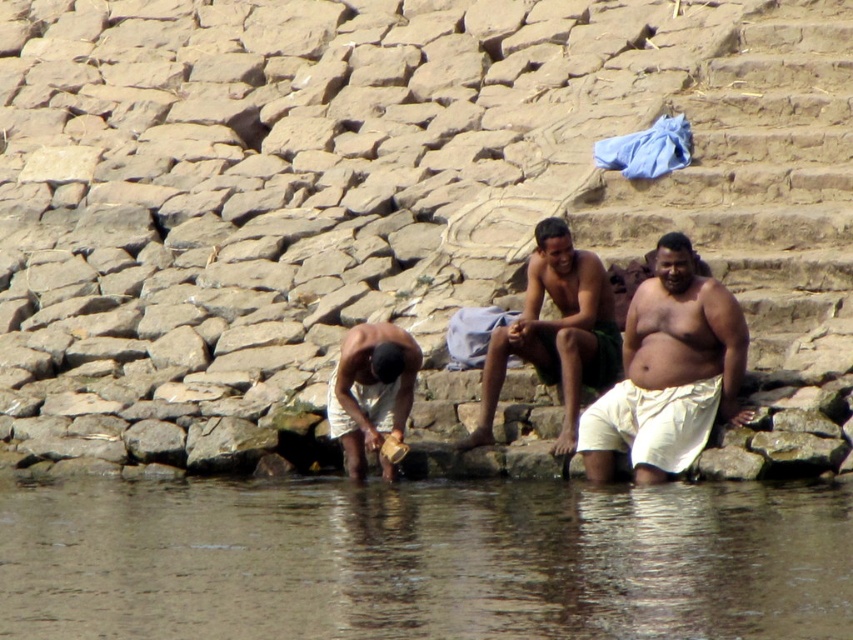
You are standing at the center of the riverbank and want to place a small object on the smooth rock at lower left. Which direction should you move to reach it?

The smooth rock at lower left is located at point [397,211], so you should move to the left and slightly forward to reach it.

You are standing on the riverbank and want to place the white cotton cloth at center on top of the smooth rock at lower left. Is this possible based on their positions?

The smooth rock at lower left is in front of the white cotton cloth at center, so placing the cloth on the rock would require moving the cloth forward to the rock. However, since the rock is already in front, the cloth is behind it. Therefore, you can place the white cotton cloth at center on the smooth rock at lower left by moving it forward.

You are a hiker who needs to cross the river shown in the image. You see the brown water at lower center and the white cloth at lower left. Which one is more suitable to use as a makeshift water filter? Please explain your reasoning based on their sizes.

The white cloth at lower left is more suitable to use as a makeshift water filter because it has a smaller size compared to the brown water at lower center, making it easier to handle and use for filtering purposes.